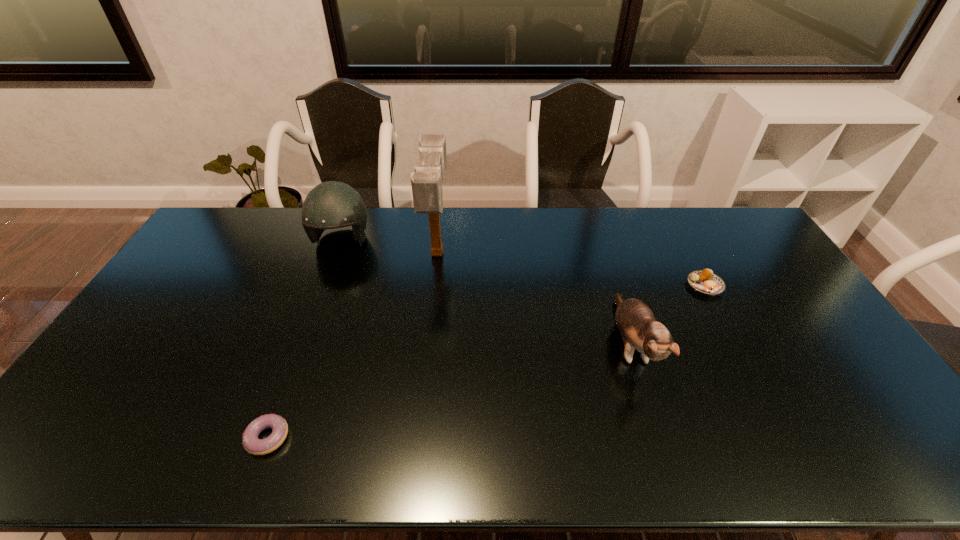
Locate an element on the screen. The width and height of the screenshot is (960, 540). vacant space that's between the football helmet and the nearest object is located at coordinates (304, 339).

Identify the location of free space between the tallest object and the football helmet. This screenshot has height=540, width=960. (390, 247).

Where is `unoccupied area between the rightmost object and the third object from right to left`? This screenshot has width=960, height=540. unoccupied area between the rightmost object and the third object from right to left is located at coordinates click(x=571, y=269).

The height and width of the screenshot is (540, 960). Identify the location of free area in between the football helmet and the nearest object. (304, 339).

The width and height of the screenshot is (960, 540). I want to click on vacant area that lies between the third object from left to right and the football helmet, so click(x=390, y=247).

Where is `free spot between the second object from right to left and the rightmost object`? The width and height of the screenshot is (960, 540). free spot between the second object from right to left and the rightmost object is located at coordinates (667, 315).

Find the location of `empty space that is in between the rightmost object and the doughnut`. empty space that is in between the rightmost object and the doughnut is located at coordinates (487, 361).

Find the location of a particular element. This screenshot has width=960, height=540. vacant area between the third object from left to right and the rightmost object is located at coordinates (571, 269).

Locate an element on the screen. vacant space in between the rightmost object and the cat is located at coordinates (667, 315).

Select which object is the fourth closest to the mallet. Please provide its 2D coordinates. Your answer should be formatted as a tuple, i.e. [(x, y)], where the tuple contains the x and y coordinates of a point satisfying the conditions above.

[(704, 281)]